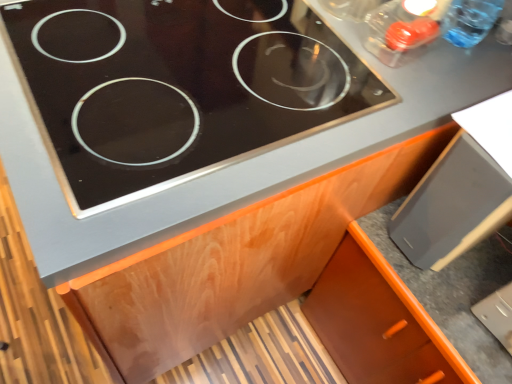
Question: Considering the relative sizes of black glass cooktop at upper center and orange wood cabinet at lower right in the image provided, is black glass cooktop at upper center wider than orange wood cabinet at lower right?

Choices:
 (A) yes
 (B) no

Answer: (B)

Question: From the image's perspective, is black glass cooktop at upper center above orange wood cabinet at lower right?

Choices:
 (A) yes
 (B) no

Answer: (A)

Question: Does black glass cooktop at upper center have a larger size compared to orange wood cabinet at lower right?

Choices:
 (A) yes
 (B) no

Answer: (B)

Question: Is black glass cooktop at upper center positioned behind orange wood cabinet at lower right?

Choices:
 (A) no
 (B) yes

Answer: (A)

Question: From a real-world perspective, is black glass cooktop at upper center physically below orange wood cabinet at lower right?

Choices:
 (A) yes
 (B) no

Answer: (B)

Question: Is orange wood cabinet at lower right bigger or smaller than black glass cooktop at upper center?

Choices:
 (A) small
 (B) big

Answer: (B)

Question: In terms of height, does orange wood cabinet at lower right look taller or shorter compared to black glass cooktop at upper center?

Choices:
 (A) tall
 (B) short

Answer: (A)

Question: Considering the positions of orange wood cabinet at lower right and black glass cooktop at upper center in the image, is orange wood cabinet at lower right wider or thinner than black glass cooktop at upper center?

Choices:
 (A) wide
 (B) thin

Answer: (A)

Question: Considering the positions of point (391, 357) and point (295, 122), is point (391, 357) closer or farther from the camera than point (295, 122)?

Choices:
 (A) closer
 (B) farther

Answer: (B)

Question: Considering the positions of black glass cooktop at upper center and orange wood cabinet at lower right in the image, is black glass cooktop at upper center wider or thinner than orange wood cabinet at lower right?

Choices:
 (A) wide
 (B) thin

Answer: (B)

Question: Considering their positions, is black glass cooktop at upper center located in front of or behind orange wood cabinet at lower right?

Choices:
 (A) behind
 (B) front

Answer: (B)

Question: From the image's perspective, is black glass cooktop at upper center positioned above or below orange wood cabinet at lower right?

Choices:
 (A) below
 (B) above

Answer: (B)

Question: Is point (62, 18) closer or farther from the camera than point (315, 314)?

Choices:
 (A) closer
 (B) farther

Answer: (A)

Question: In terms of width, does transparent plastic bottle at upper right look wider or thinner when compared to orange wood cabinet at lower right?

Choices:
 (A) thin
 (B) wide

Answer: (A)

Question: In the image, is transparent plastic bottle at upper right on the left side or the right side of orange wood cabinet at lower right?

Choices:
 (A) left
 (B) right

Answer: (A)